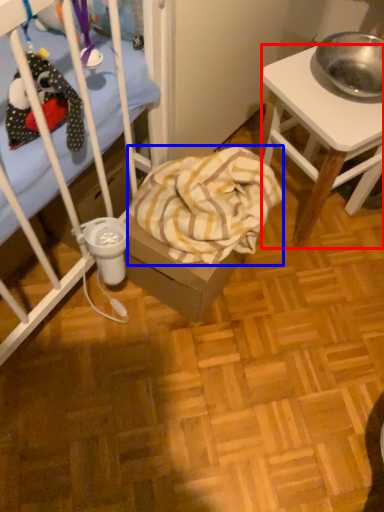
Question: Which object is further to the camera taking this photo, desk (highlighted by a red box) or blanket (highlighted by a blue box)?

Choices:
 (A) desk
 (B) blanket

Answer: (B)